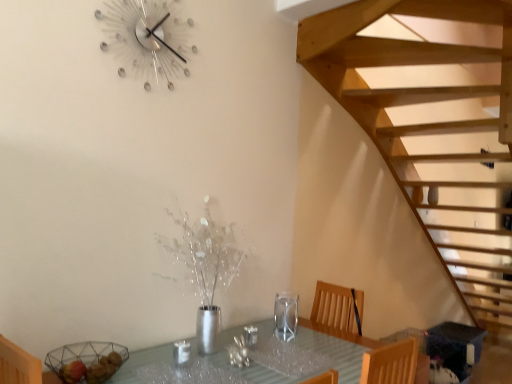
Locate an element on the screen. Image resolution: width=512 pixels, height=384 pixels. free space in front of transparent glass wine glass at center is located at coordinates (306, 340).